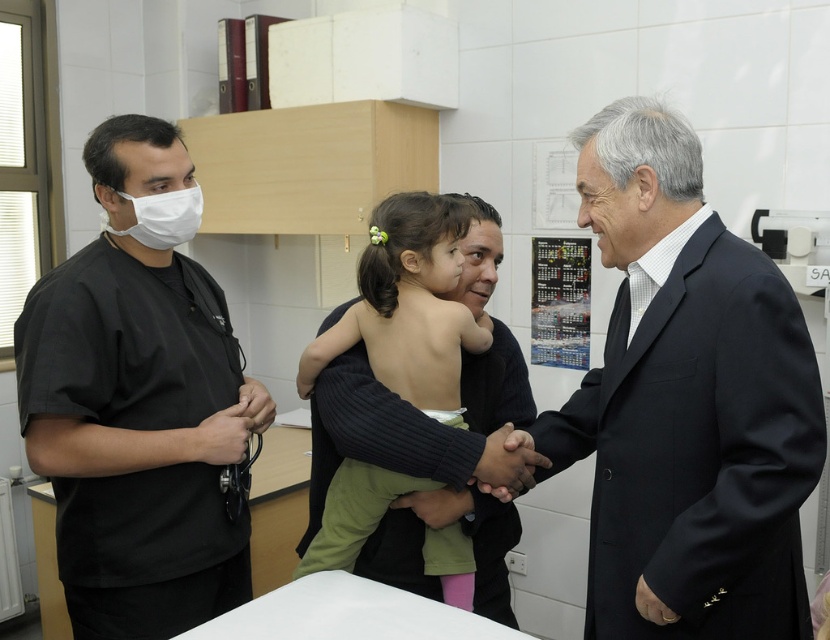
Does black suit coat at center have a lesser height compared to black scrubs at left?

Yes.

Between black suit coat at center and black scrubs at left, which one is positioned higher?

black suit coat at center is higher up.

Describe the element at coordinates (686, 403) in the screenshot. I see `black suit coat at center` at that location.

Image resolution: width=830 pixels, height=640 pixels. In order to click on black suit coat at center in this screenshot , I will do `click(686, 403)`.

Which of these two, black scrubs at left or skinny green dress at center, stands shorter?

skinny green dress at center

Between point (179, 465) and point (453, 380), which one is positioned behind?

The point (179, 465) is more distant.

This screenshot has width=830, height=640. I want to click on black scrubs at left, so click(x=135, y=400).

Can you confirm if skinny green dress at center is positioned to the right of metallic keychain at lower left?

Indeed, skinny green dress at center is positioned on the right side of metallic keychain at lower left.

Consider the image. Who is shorter, skinny green dress at center or metallic keychain at lower left?

metallic keychain at lower left

Between point (464, 202) and point (237, 440), which one is positioned behind?

The point (464, 202) is behind.

At what (x,y) coordinates should I click in order to perform the action: click on skinny green dress at center. Please return your answer as a coordinate pair (x, y). The image size is (830, 640). Looking at the image, I should click on (408, 307).